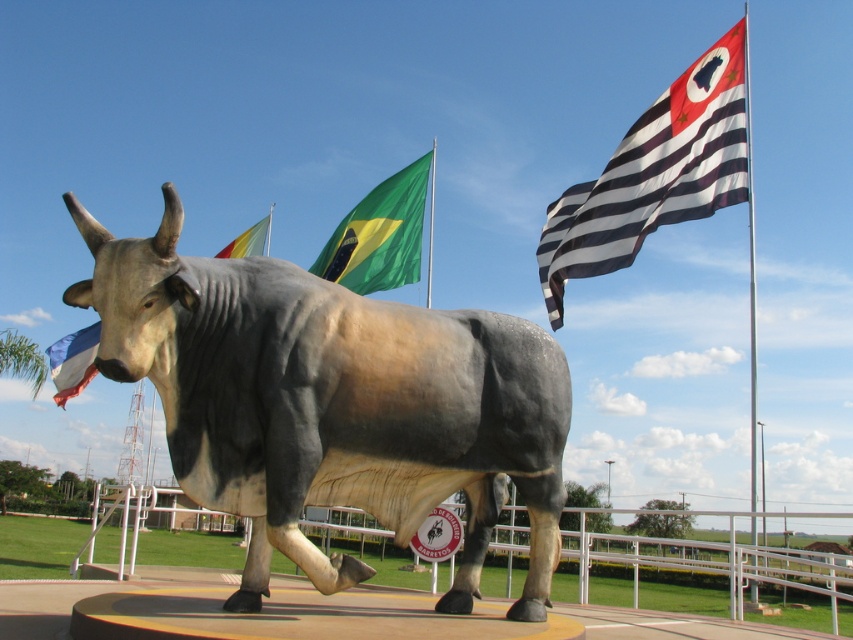
Question: Which point is farther from the camera taking this photo?

Choices:
 (A) (427, 285)
 (B) (62, 356)

Answer: (A)

Question: Is polyester flag at upper center wider than green fabric flag pole at center?

Choices:
 (A) yes
 (B) no

Answer: (A)

Question: Can you confirm if black and white striped flag at upper right is bigger than green fabric flag pole at center?

Choices:
 (A) yes
 (B) no

Answer: (A)

Question: Based on their relative distances, which object is nearer to the polished bronze bull at center?

Choices:
 (A) polyester flag at upper center
 (B) green fabric flag pole at center
 (C) black and white striped flag pole at upper right
 (D) green fabric flag at center

Answer: (C)

Question: Can you confirm if polyester flag at upper center is positioned below green fabric flag pole at center?

Choices:
 (A) no
 (B) yes

Answer: (B)

Question: Which of these objects is positioned closest to the polyester flag at upper center?

Choices:
 (A) green fabric flag pole at upper center
 (B) blue fabric flag at lower left

Answer: (A)